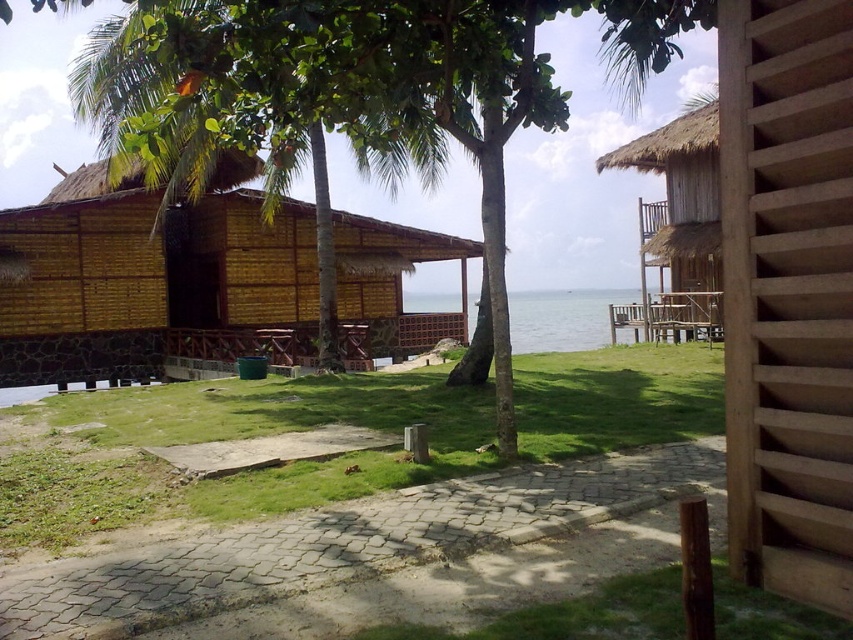
Question: Considering the real-world distances, which object is farthest from the clear blue water at center?

Choices:
 (A) thatched bamboo hut at upper right
 (B) matte bamboo hut at center
 (C) green grass at center
 (D) green leafy tree at center

Answer: (C)

Question: Can you confirm if green leafy tree at center is thinner than thatched bamboo hut at upper right?

Choices:
 (A) no
 (B) yes

Answer: (A)

Question: Which object is positioned closest to the matte bamboo hut at center?

Choices:
 (A) clear blue water at center
 (B) thatched bamboo hut at upper right
 (C) green leafy tree at center

Answer: (C)

Question: Among these objects, which one is farthest from the camera?

Choices:
 (A) thatched bamboo hut at upper right
 (B) clear blue water at center

Answer: (B)

Question: Can you confirm if green leafy tree at center is positioned above thatched bamboo hut at upper right?

Choices:
 (A) no
 (B) yes

Answer: (B)

Question: Can you confirm if matte bamboo hut at center is positioned to the left of green leafy tree at center?

Choices:
 (A) yes
 (B) no

Answer: (A)